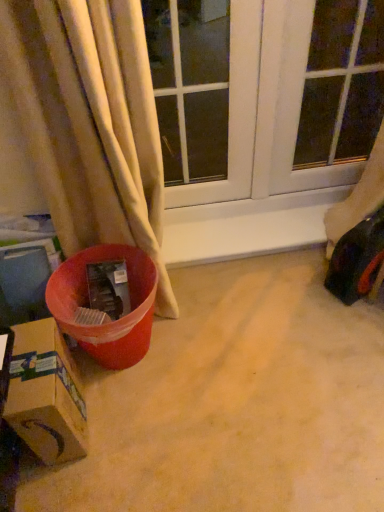
Question: Considering the positions of shiny plastic toy car at right and transparent glass window at center in the image, is shiny plastic toy car at right bigger or smaller than transparent glass window at center?

Choices:
 (A) small
 (B) big

Answer: (A)

Question: Choose the correct answer: Is shiny plastic toy car at right inside transparent glass window at center or outside it?

Choices:
 (A) inside
 (B) outside

Answer: (B)

Question: Which object is the farthest from the cardboard box at lower left?

Choices:
 (A) transparent glass window at center
 (B) shiny plastic toy car at right
 (C) transparent glass window screen at upper right

Answer: (C)

Question: Estimate the real-world distances between objects in this image. Which object is farther from the cardboard box at lower left?

Choices:
 (A) shiny plastic toy car at right
 (B) transparent glass window screen at upper right
 (C) transparent glass window at center

Answer: (B)